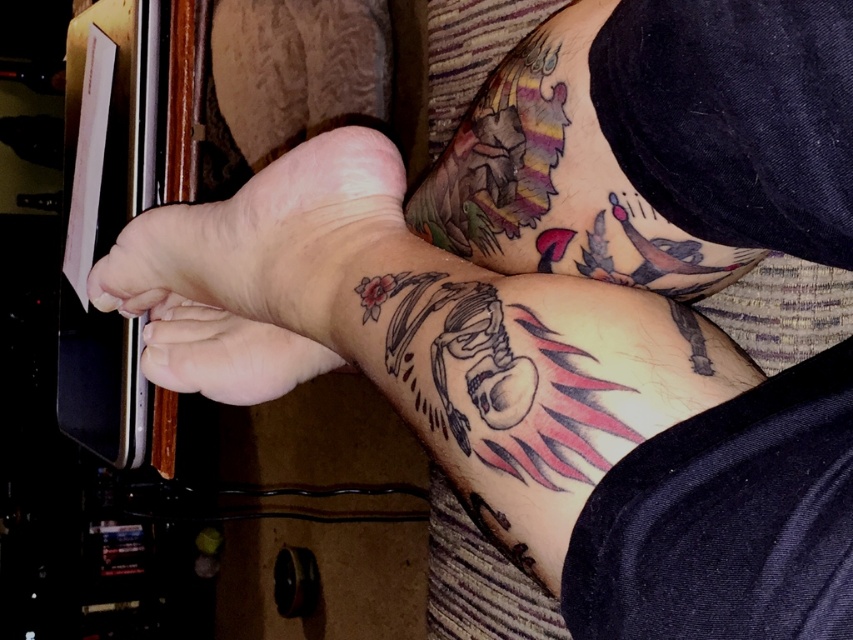
Based on the scene description, can you determine the spatial relationship between the skinsmoothhand at center and the matte skin at center?

The skinsmoothhand at center is located above the matte skin at center.

In the scene shown: You are a photographer adjusting your camera settings. You notice two points of interest on the subject, one at point (393, 164) and the other at point (282, 371). Which point is closer to the camera lens?

Point (393, 164) is in front of point (282, 371), so it is closer to the camera lens.